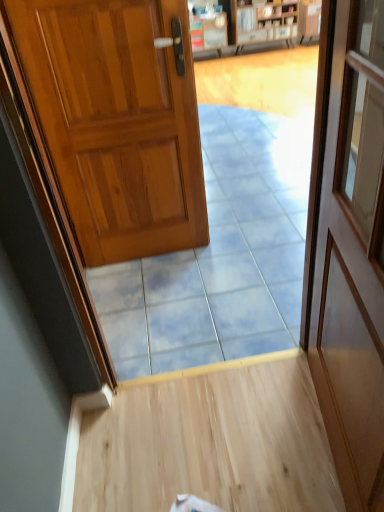
Question: Is shiny wood door at left, which is the second door in front-to-back order, to the left of wooden bookshelf at upper center from the viewer's perspective?

Choices:
 (A) yes
 (B) no

Answer: (A)

Question: Is shiny wood door at left, positioned as the second door in right-to-left order, in contact with wooden bookshelf at upper center?

Choices:
 (A) no
 (B) yes

Answer: (A)

Question: From a real-world perspective, is shiny wood door at left, the first door viewed from the left, over wooden bookshelf at upper center?

Choices:
 (A) yes
 (B) no

Answer: (A)

Question: Does shiny wood door at left, positioned as the second door in right-to-left order, appear on the right side of wooden bookshelf at upper center?

Choices:
 (A) no
 (B) yes

Answer: (A)

Question: Is shiny wood door at left, positioned as the 1th door in back-to-front order, bigger than wooden bookshelf at upper center?

Choices:
 (A) no
 (B) yes

Answer: (A)

Question: From the image's perspective, is blue glossy tile at center positioned above or below wooden door at right, marked as the 2th door in a back-to-front arrangement?

Choices:
 (A) above
 (B) below

Answer: (B)

Question: From a real-world perspective, is blue glossy tile at center above or below wooden door at right, the 1th door positioned from the front?

Choices:
 (A) below
 (B) above

Answer: (A)

Question: In terms of height, does blue glossy tile at center look taller or shorter compared to wooden door at right, the 1th door positioned from the front?

Choices:
 (A) tall
 (B) short

Answer: (B)

Question: Would you say blue glossy tile at center is to the left or to the right of wooden door at right, the 2th door viewed from the left, in the picture?

Choices:
 (A) right
 (B) left

Answer: (B)

Question: Is wooden door at right, which appears as the first door when viewed from the right, taller or shorter than wooden bookshelf at upper center?

Choices:
 (A) tall
 (B) short

Answer: (A)

Question: Is wooden door at right, which appears as the first door when viewed from the right, inside the boundaries of wooden bookshelf at upper center, or outside?

Choices:
 (A) inside
 (B) outside

Answer: (B)

Question: Considering their positions, is wooden door at right, marked as the 2th door in a back-to-front arrangement, located in front of or behind wooden bookshelf at upper center?

Choices:
 (A) behind
 (B) front

Answer: (B)

Question: From a real-world perspective, is wooden door at right, the 1th door positioned from the front, above or below wooden bookshelf at upper center?

Choices:
 (A) above
 (B) below

Answer: (A)

Question: Considering the positions of wooden door at right, which appears as the first door when viewed from the right, and shiny wood door at left, which is the second door in front-to-back order, in the image, is wooden door at right, which appears as the first door when viewed from the right, wider or thinner than shiny wood door at left, which is the second door in front-to-back order,?

Choices:
 (A) wide
 (B) thin

Answer: (B)

Question: From a real-world perspective, is wooden door at right, the 1th door positioned from the front, positioned above or below shiny wood door at left, the first door viewed from the left?

Choices:
 (A) above
 (B) below

Answer: (A)